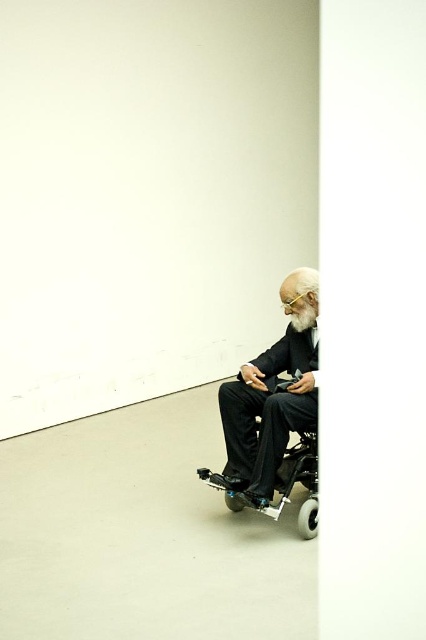
You are a caregiver assisting a patient who needs to move from the current position to the door located at the far left wall. The path to the door is blocked by two wheelchairs. Which wheelchair should you move first to clear the path? The options are the black matte wheelchair at right and the black plastic wheelchair at lower right.

You should move the black plastic wheelchair at lower right first because the black matte wheelchair at right is to the right of it, meaning the black plastic wheelchair at lower right is closer to the door and needs to be moved first to clear the path.

You are standing in the room where the man in the wheelchair is located. You want to place a small potted plant exactly at point (261, 452). If you are currently 2 meters away from the wheelchair, can you reach the point without moving closer than 1.5 meters to the wheelchair?

The distance of point (261, 452) from viewer is 3.23 meters. Since you are currently 2 meters away from the wheelchair, you need to move 1.23 meters closer to reach the point. However, moving 1.23 meters closer would bring you to 0.77 meters away from the wheelchair, which is less than the 1.5 meters minimum distance required. Therefore, you cannot reach the point without violating the distance constraint.